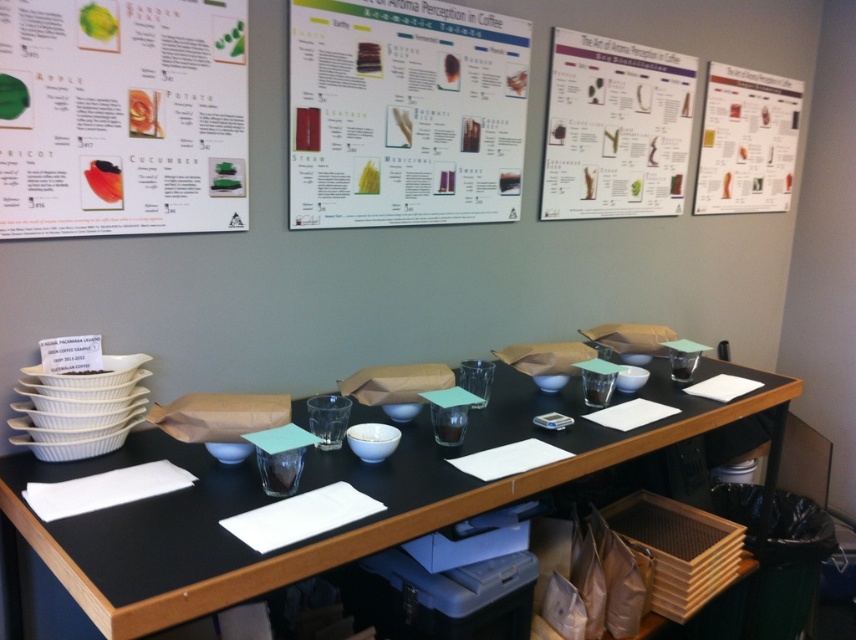
You are standing 5 feet away from the table in the workspace. There is a white paperboard poster at upper center that you need to reach. Can you reach it without moving closer?

The white paperboard poster at upper center is 4.87 feet from the camera, so since you are standing 5 feet away from the table, you might be just out of reach. You may need to take a small step forward to touch it.

You are a barista setting up for a coffee tasting event. You need to place a new decorative poster behind the black matte table at center. Is there already a matte paper poster at upper right that might be in the way?

Yes, the matte paper poster at upper right is already present behind the black matte table at center, so it would be in the way when placing the new poster.

You are a barista attending a coffee aroma workshop. You see two posters on the table in front of you. The first is the white paperboard poster at upper center and the second is the matte paper poster at upper right. Which poster is taller?

The matte paper poster at upper right is taller than the white paperboard poster at upper center.